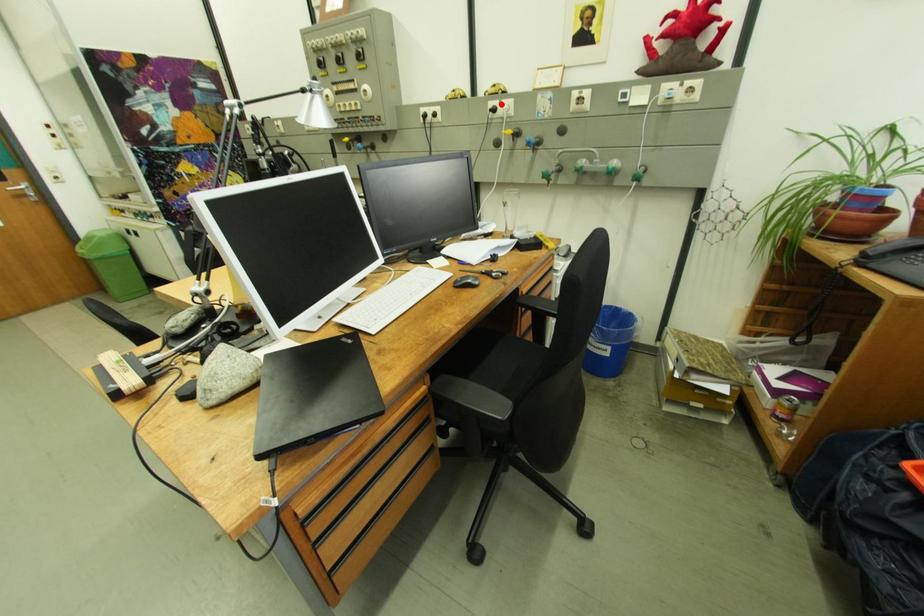
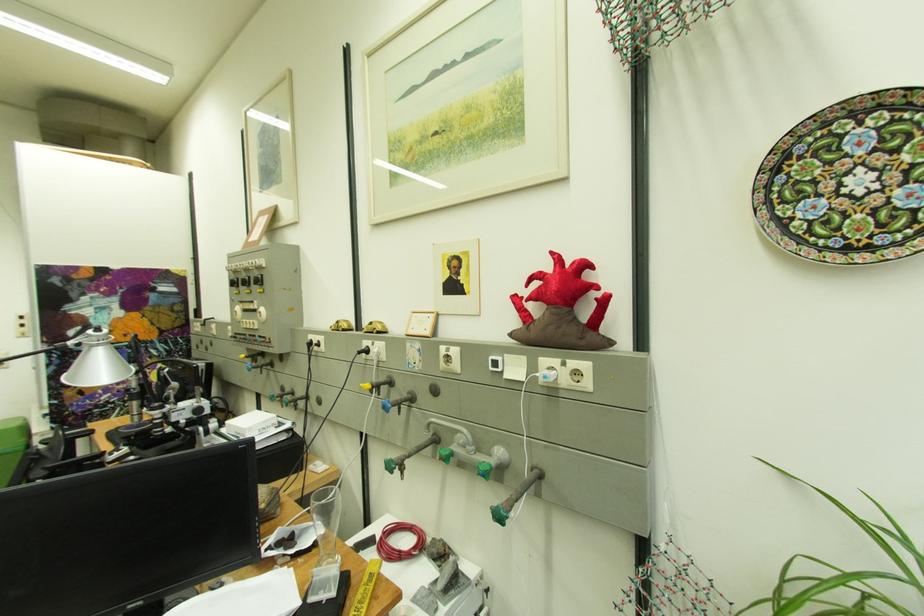
Find the pixel in the second image that matches the highlighted location in the first image.

(375, 344)